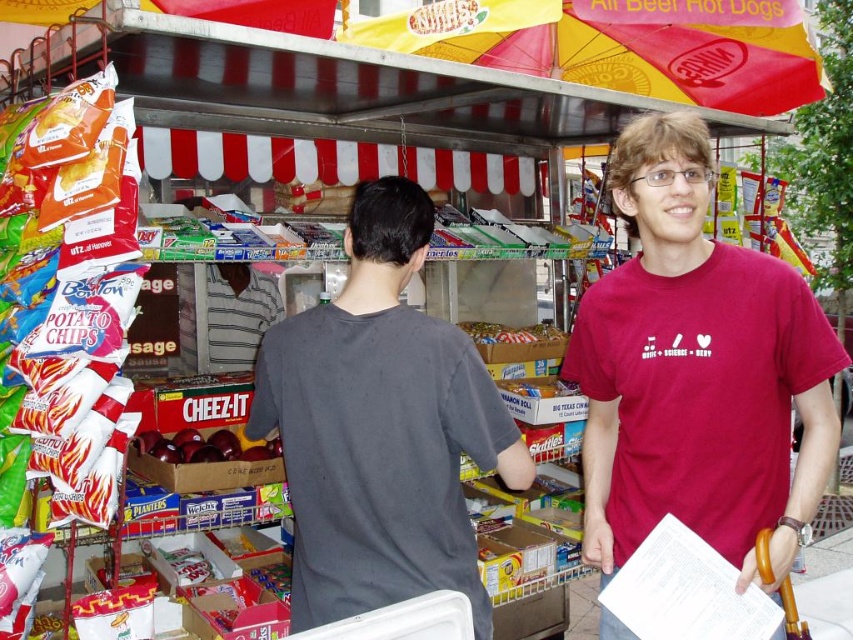
Question: From the image, what is the correct spatial relationship of matte red t-shirt at center in relation to dark gray t-shirt at center?

Choices:
 (A) below
 (B) above

Answer: (B)

Question: Which object is positioned closest to the yellow cardboard box at center?

Choices:
 (A) red glossy apples at center
 (B) matte red t-shirt at center
 (C) red fabric umbrella at upper center

Answer: (A)

Question: Considering the real-world distances, which object is farthest from the matte red t-shirt at center?

Choices:
 (A) red glossy apples at center
 (B) matte brown candy at center
 (C) red fabric umbrella at upper center

Answer: (B)

Question: Which of the following is the farthest from the observer?

Choices:
 (A) (263, 353)
 (B) (558, 384)
 (C) (263, 456)
 (D) (675, 60)

Answer: (D)

Question: Is red fabric umbrella at upper center wider than matte brown candy at center?

Choices:
 (A) no
 (B) yes

Answer: (B)

Question: Can you confirm if matte red t-shirt at center is thinner than yellow cardboard box at center?

Choices:
 (A) yes
 (B) no

Answer: (B)